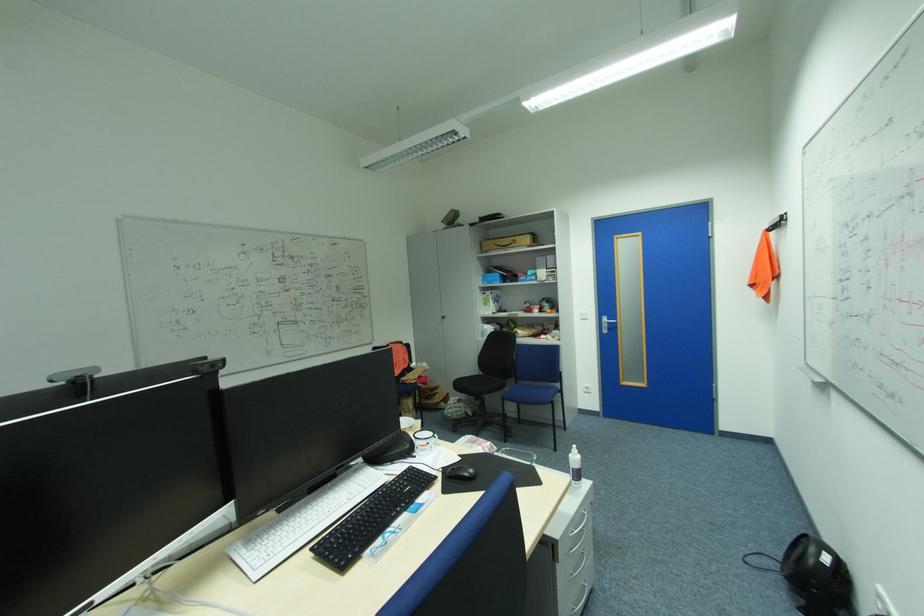
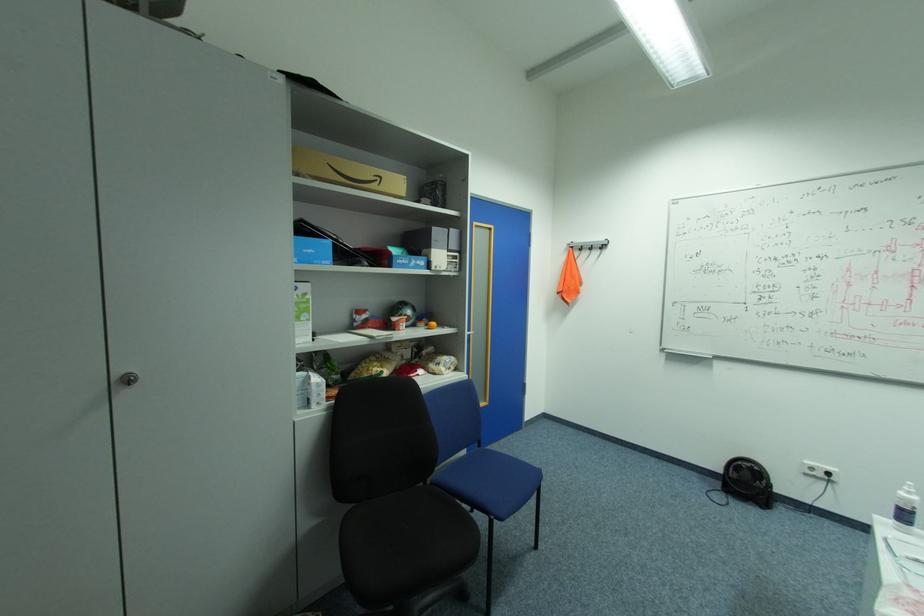
Locate, in the second image, the point that corresponds to the point at 521,240 in the first image.

(386, 177)